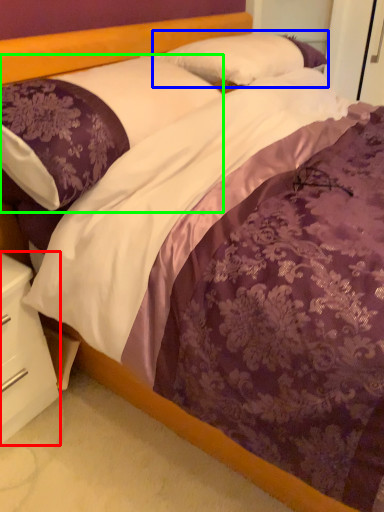
Question: Considering the real-world distances, which object is farthest from nightstand (highlighted by a red box)? pillow (highlighted by a blue box) or pillow (highlighted by a green box)?

Choices:
 (A) pillow
 (B) pillow

Answer: (A)